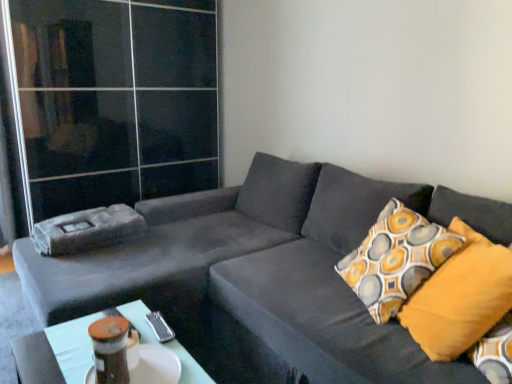
Question: Is matte plastic table at lower center far from mustard yellow fabric pillow at right?

Choices:
 (A) no
 (B) yes

Answer: (A)

Question: Are matte plastic table at lower center and mustard yellow fabric pillow at right beside each other?

Choices:
 (A) no
 (B) yes

Answer: (A)

Question: Is matte plastic table at lower center turned away from mustard yellow fabric pillow at right?

Choices:
 (A) yes
 (B) no

Answer: (A)

Question: Does matte plastic table at lower center have a lesser height compared to mustard yellow fabric pillow at right?

Choices:
 (A) no
 (B) yes

Answer: (B)

Question: Is matte plastic table at lower center facing towards mustard yellow fabric pillow at right?

Choices:
 (A) yes
 (B) no

Answer: (B)

Question: From a real-world perspective, is matte plastic table at lower center above or below transparent glass door at upper left?

Choices:
 (A) above
 (B) below

Answer: (B)

Question: Based on their positions, is matte plastic table at lower center located to the left or right of transparent glass door at upper left?

Choices:
 (A) right
 (B) left

Answer: (A)

Question: In terms of width, does matte plastic table at lower center look wider or thinner when compared to transparent glass door at upper left?

Choices:
 (A) wide
 (B) thin

Answer: (B)

Question: Considering their positions, is matte plastic table at lower center located in front of or behind transparent glass door at upper left?

Choices:
 (A) behind
 (B) front

Answer: (B)

Question: Would you say matte plastic table at lower center is to the left or to the right of mustard yellow fabric pillow at right in the picture?

Choices:
 (A) right
 (B) left

Answer: (B)

Question: Considering their positions, is matte plastic table at lower center located in front of or behind mustard yellow fabric pillow at right?

Choices:
 (A) behind
 (B) front

Answer: (B)

Question: Is point (66, 372) closer or farther from the camera than point (444, 319)?

Choices:
 (A) closer
 (B) farther

Answer: (A)

Question: Looking at the image, does matte plastic table at lower center seem bigger or smaller compared to mustard yellow fabric pillow at right?

Choices:
 (A) big
 (B) small

Answer: (B)

Question: From the image's perspective, relative to velvet gray couch at center, is matte plastic table at lower center above or below?

Choices:
 (A) below
 (B) above

Answer: (A)

Question: Is matte plastic table at lower center wider or thinner than velvet gray couch at center?

Choices:
 (A) thin
 (B) wide

Answer: (A)